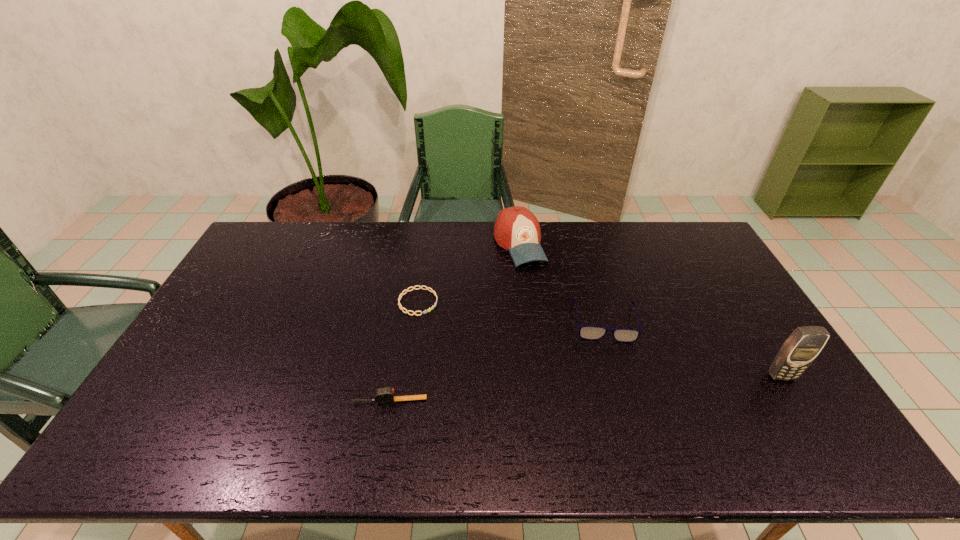
Where is `vacant space in between the second tallest object and the bracelet`? vacant space in between the second tallest object and the bracelet is located at coordinates pos(468,273).

You are a GUI agent. You are given a task and a screenshot of the screen. Output one action in this format:
    pyautogui.click(x=<x>, y=<y>)
    Task: Click on the unoccupied area between the spectacles and the nearest object
    The width and height of the screenshot is (960, 540).
    Given the screenshot: What is the action you would take?
    pyautogui.click(x=497, y=361)

The width and height of the screenshot is (960, 540). I want to click on vacant space in between the third tallest object and the fourth tallest object, so click(497, 361).

This screenshot has width=960, height=540. I want to click on free space between the nearest object and the fourth farthest object, so click(x=586, y=389).

Find the location of a particular element. unoccupied position between the third object from right to left and the fourth tallest object is located at coordinates (454, 322).

Find the location of a particular element. Image resolution: width=960 pixels, height=540 pixels. unoccupied position between the rightmost object and the baseball cap is located at coordinates (650, 310).

At what (x,y) coordinates should I click in order to perform the action: click on empty location between the bracelet and the second tallest object. Please return your answer as a coordinate pair (x, y). The width and height of the screenshot is (960, 540). Looking at the image, I should click on (468, 273).

I want to click on vacant area that lies between the shortest object and the nearest object, so click(403, 352).

You are a GUI agent. You are given a task and a screenshot of the screen. Output one action in this format:
    pyautogui.click(x=<x>, y=<y>)
    Task: Click on the free space between the fourth shortest object and the spectacles
    This screenshot has width=960, height=540.
    Given the screenshot: What is the action you would take?
    pyautogui.click(x=563, y=282)

The width and height of the screenshot is (960, 540). Identify the location of object identified as the fourth closest to the second nearest object. (420, 287).